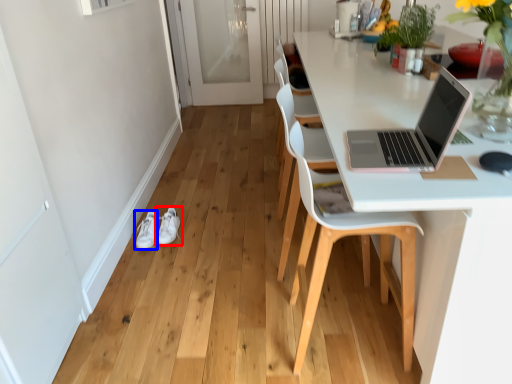
Question: Which object appears closest to the camera in this image, footwear (highlighted by a red box) or footwear (highlighted by a blue box)?

Choices:
 (A) footwear
 (B) footwear

Answer: (B)